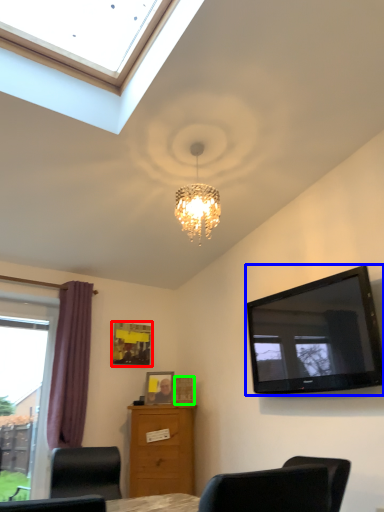
Question: Which object is the closest to the picture frame (highlighted by a red box)? Choose among these: television (highlighted by a blue box) or picture frame (highlighted by a green box).

Choices:
 (A) television
 (B) picture frame

Answer: (B)